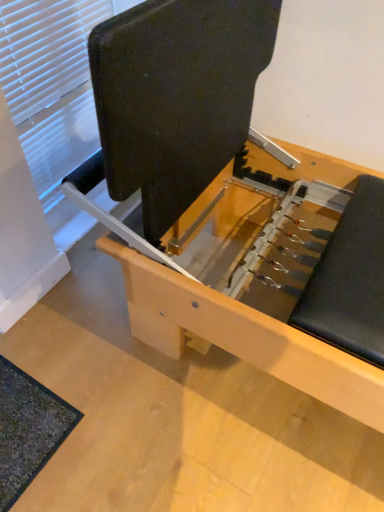
This screenshot has height=512, width=384. I want to click on free spot above matte black bench at center (from a real-world perspective), so click(181, 368).